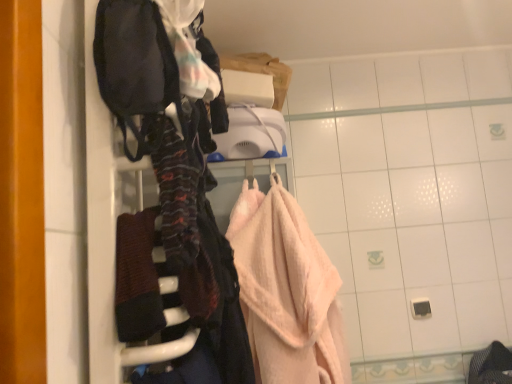
Question: Considering the positions of dark brown textured towel at center and velvet dark bag at left in the image, is dark brown textured towel at center bigger or smaller than velvet dark bag at left?

Choices:
 (A) small
 (B) big

Answer: (A)

Question: Relative to velvet dark bag at left, is dark brown textured towel at center in front or behind?

Choices:
 (A) behind
 (B) front

Answer: (A)

Question: Which of these objects is positioned farthest from the dark brown textured towel at center?

Choices:
 (A) velvet dark bag at left
 (B) pink terry cloth towel at center

Answer: (B)

Question: Estimate the real-world distances between objects in this image. Which object is farther from the velvet dark bag at left?

Choices:
 (A) dark brown textured towel at center
 (B) pink terry cloth towel at center

Answer: (B)